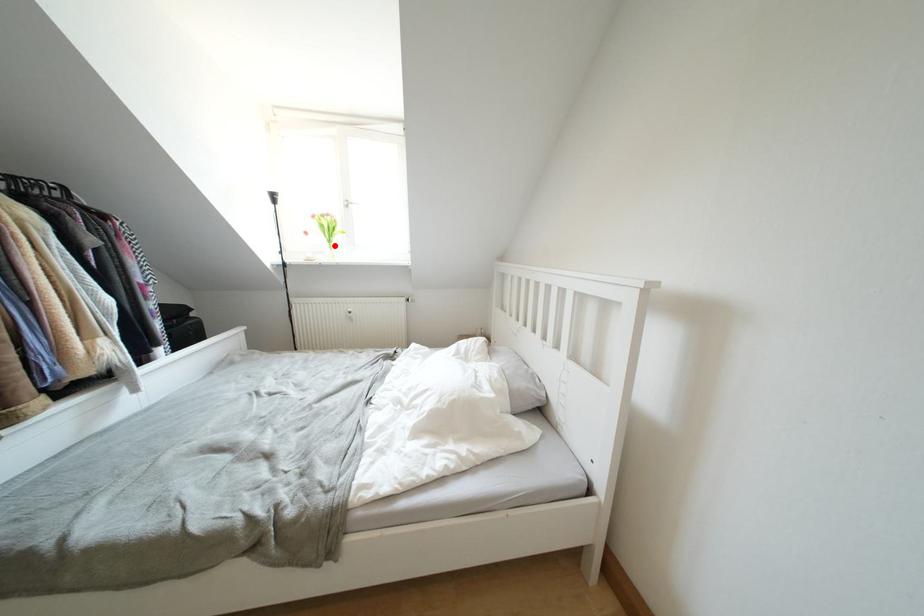
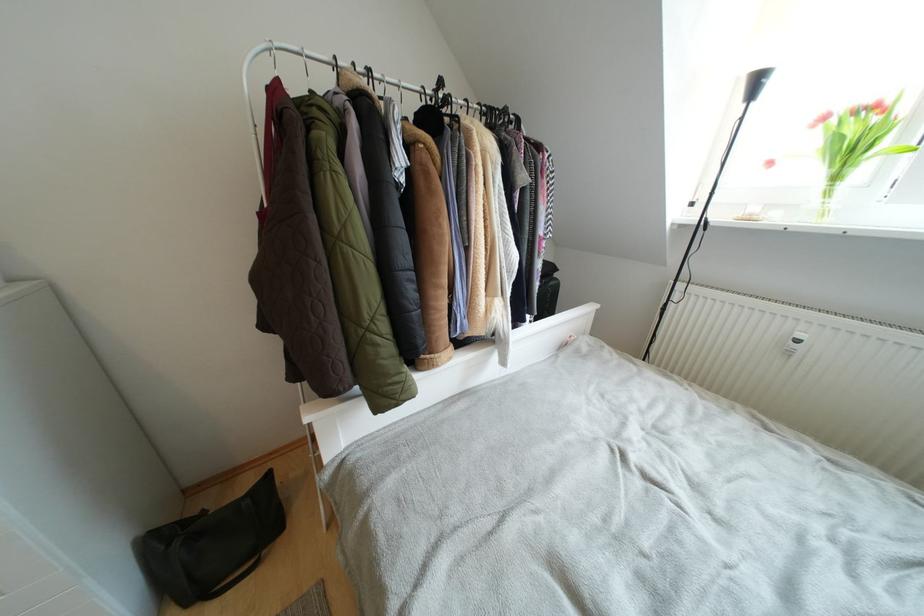
Where in the second image is the point corresponding to the highlighted location from the first image?

(840, 182)